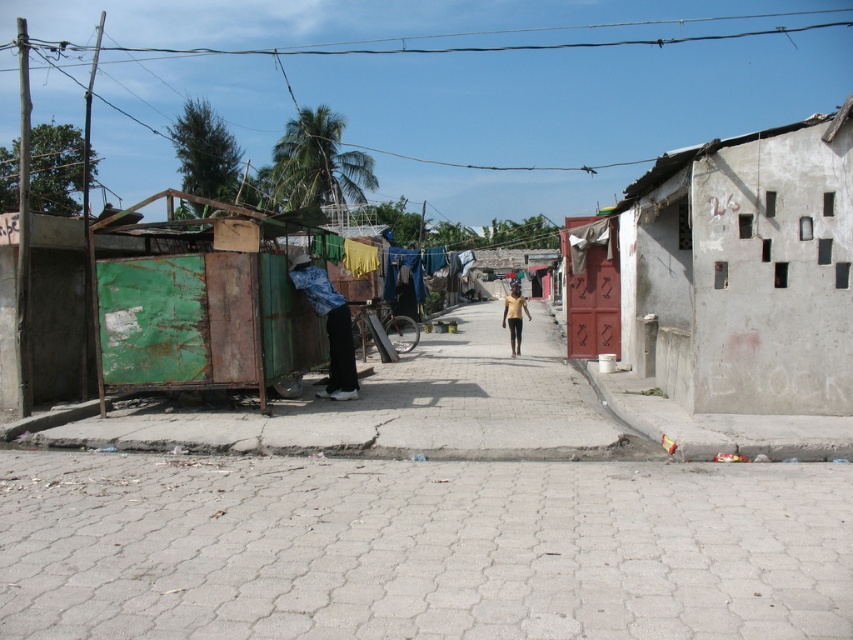
Question: Considering the real-world distances, which object is closest to the rusty metal container at left?

Choices:
 (A) gold metallic person at center
 (B) white concrete wall at right

Answer: (B)

Question: Can you confirm if rusty metal container at left is smaller than gold metallic person at center?

Choices:
 (A) yes
 (B) no

Answer: (A)

Question: Does denim jacket at left appear on the right side of gold metallic person at center?

Choices:
 (A) yes
 (B) no

Answer: (B)

Question: Which object is positioned farthest from the rusty metal container at left?

Choices:
 (A) gold metallic person at center
 (B) denim jacket at left
 (C) white concrete wall at right

Answer: (A)

Question: Among these objects, which one is nearest to the camera?

Choices:
 (A) denim jacket at left
 (B) rusty metal container at left

Answer: (B)

Question: Can you confirm if white concrete wall at right is positioned to the left of gold metallic person at center?

Choices:
 (A) no
 (B) yes

Answer: (A)